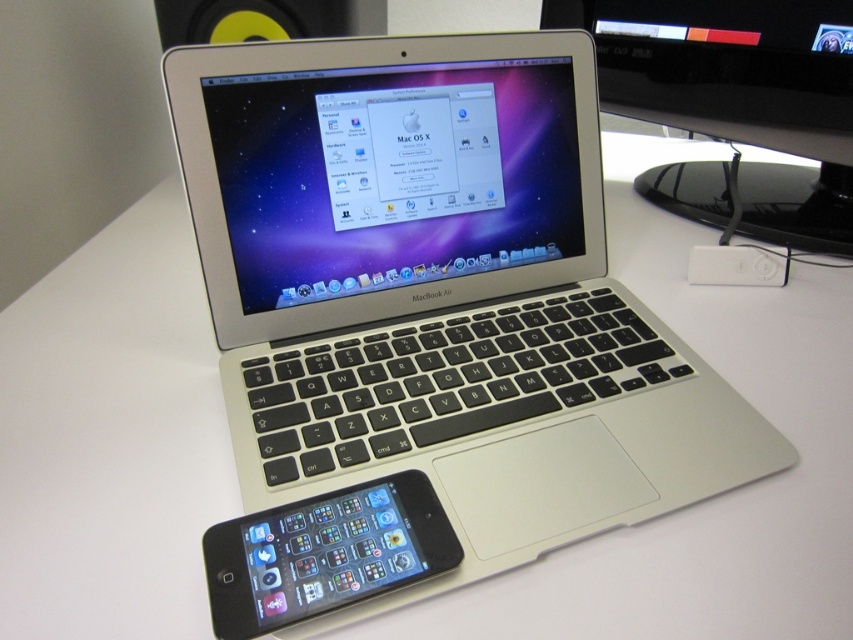
Is black glossy iphone at lower left shorter than yellow plastic speaker at upper left?

Indeed, black glossy iphone at lower left has a lesser height compared to yellow plastic speaker at upper left.

Does black glossy iphone at lower left have a greater height compared to yellow plastic speaker at upper left?

Incorrect, black glossy iphone at lower left's height is not larger of yellow plastic speaker at upper left's.

Is point (235, 579) positioned behind point (167, 13)?

No, (235, 579) is in front of (167, 13).

Locate an element on the screen. The image size is (853, 640). black glossy iphone at lower left is located at coordinates [323, 554].

From the picture: Between silver/black keyboard at center and yellow plastic speaker at upper left, which one is positioned higher?

yellow plastic speaker at upper left is above.

What do you see at coordinates (433, 308) in the screenshot? Image resolution: width=853 pixels, height=640 pixels. I see `silver/black keyboard at center` at bounding box center [433, 308].

Measure the distance between silver/black keyboard at center and camera.

silver/black keyboard at center and camera are 13.77 inches apart from each other.

Identify the location of silver/black keyboard at center. Image resolution: width=853 pixels, height=640 pixels. (433, 308).

Does glossy black monitor at upper right appear over white plastic ipod at center?

Yes.

I want to click on glossy black monitor at upper right, so click(740, 93).

Where is `glossy black monitor at upper right`? The image size is (853, 640). glossy black monitor at upper right is located at coordinates (740, 93).

This screenshot has height=640, width=853. Find the location of `glossy black monitor at upper right`. glossy black monitor at upper right is located at coordinates (740, 93).